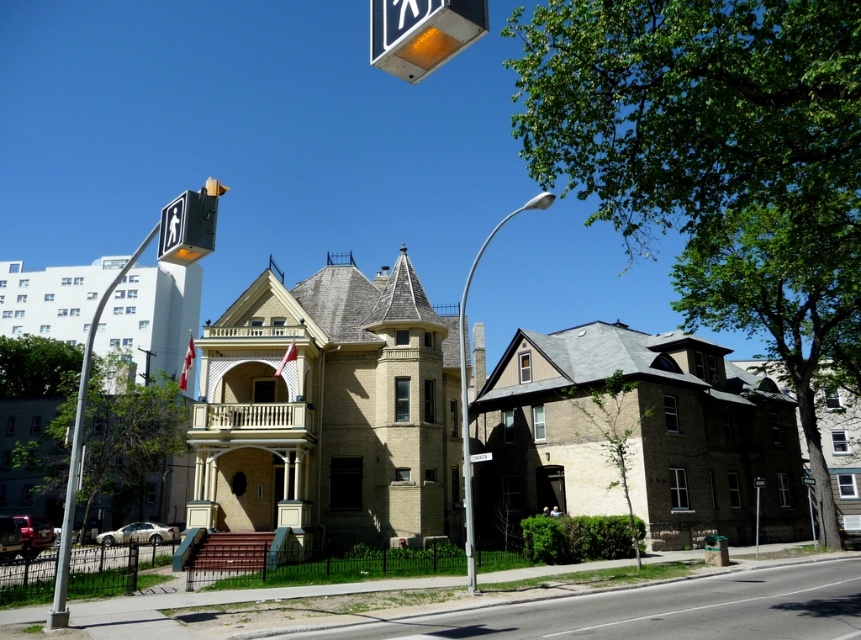
Question: Where is yellow plastic pedestrian signal at upper left located in relation to brushed metal pedestrian crossing sign at upper center in the image?

Choices:
 (A) right
 (B) left

Answer: (B)

Question: Which point is closer to the camera?

Choices:
 (A) brushed metal pedestrian crossing sign at upper center
 (B) yellow plastic pedestrian signal at upper left

Answer: (B)

Question: Does yellow plastic pedestrian signal at upper left have a lesser width compared to brushed metal pedestrian crossing sign at upper center?

Choices:
 (A) no
 (B) yes

Answer: (A)

Question: Which of the following is the closest to the observer?

Choices:
 (A) (486, 456)
 (B) (88, 352)
 (C) (189, 248)

Answer: (C)

Question: Can you confirm if silver metallic pole at left is bigger than brushed metal pedestrian crossing sign at upper center?

Choices:
 (A) no
 (B) yes

Answer: (B)

Question: Estimate the real-world distances between objects in this image. Which object is farther from the brushed metal pedestrian crossing sign at upper center?

Choices:
 (A) silver metallic pole at left
 (B) yellow plastic pedestrian signal at upper left

Answer: (A)